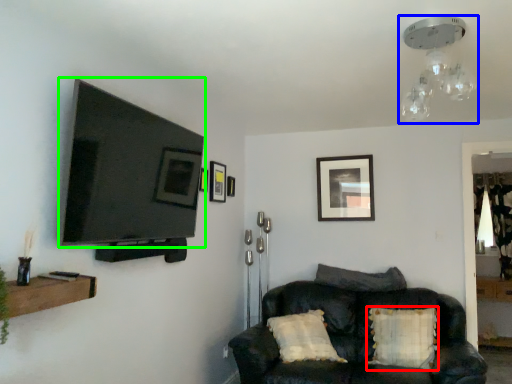
Question: Based on their relative distances, which object is nearer to pillow (highlighted by a red box)? Choose from light fixture (highlighted by a blue box) and television (highlighted by a green box).

Choices:
 (A) light fixture
 (B) television

Answer: (A)